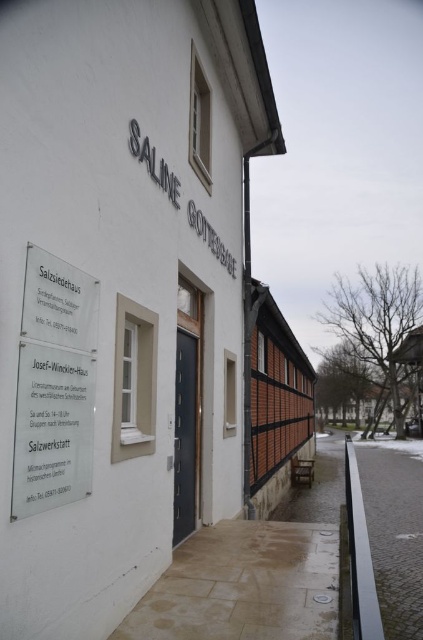
Between transparent glass sign at center and metallic gray door at center, which one appears on the left side from the viewer's perspective?

transparent glass sign at center is more to the left.

How distant is transparent glass sign at center from metallic gray door at center?

transparent glass sign at center is 9.14 feet from metallic gray door at center.

The height and width of the screenshot is (640, 423). Identify the location of transparent glass sign at center. (54, 385).